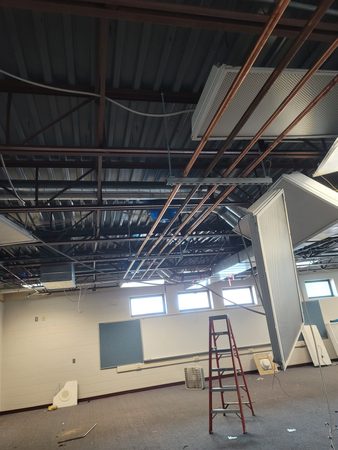
Where is `edge of floor`? edge of floor is located at coordinates (91, 398).